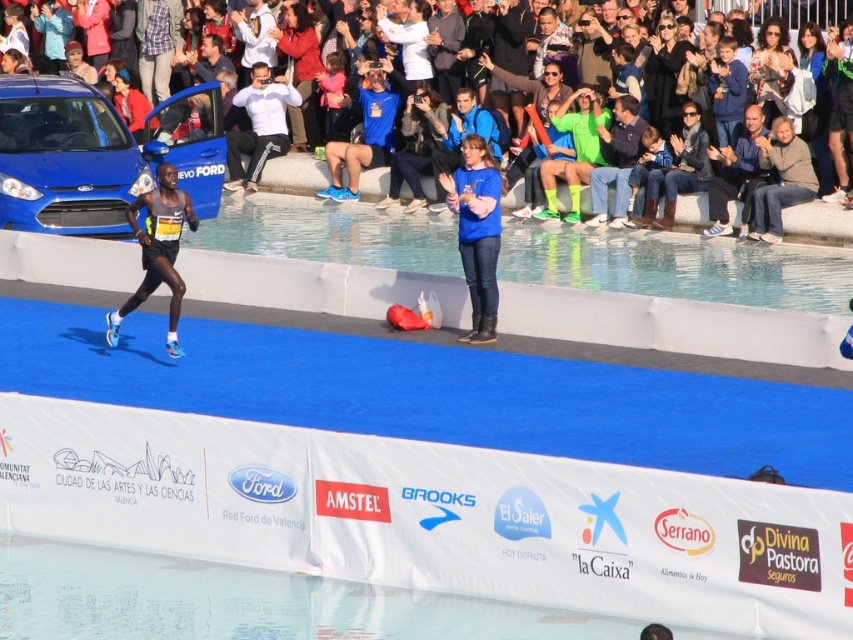
Question: Which point is closer to the camera?

Choices:
 (A) (820, 227)
 (B) (746, 228)
 (C) (271, 122)

Answer: (A)

Question: Where is matte blue car at upper left located in relation to white matte pants at center in the image?

Choices:
 (A) right
 (B) left

Answer: (A)

Question: Does matte blue car at upper left appear on the left side of red sweater at upper center?

Choices:
 (A) no
 (B) yes

Answer: (A)

Question: Does dark blue shirt at center have a larger size compared to red sweater at upper center?

Choices:
 (A) yes
 (B) no

Answer: (B)

Question: Which object is closer to the camera taking this photo?

Choices:
 (A) light brown leather jacket at upper right
 (B) blue matte ford car at left
 (C) white matte pants at center

Answer: (A)

Question: Considering the real-world distances, which object is closest to the blue matte ford car at left?

Choices:
 (A) light blue running shoes at center
 (B) red sweater at upper center
 (C) blue jeans at center
 (D) light brown leather jacket at upper right

Answer: (B)